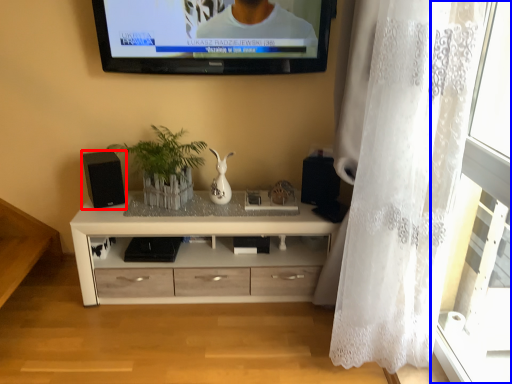
Question: Which object appears farthest to the camera in this image, speaker (highlighted by a red box) or glass door (highlighted by a blue box)?

Choices:
 (A) speaker
 (B) glass door

Answer: (A)